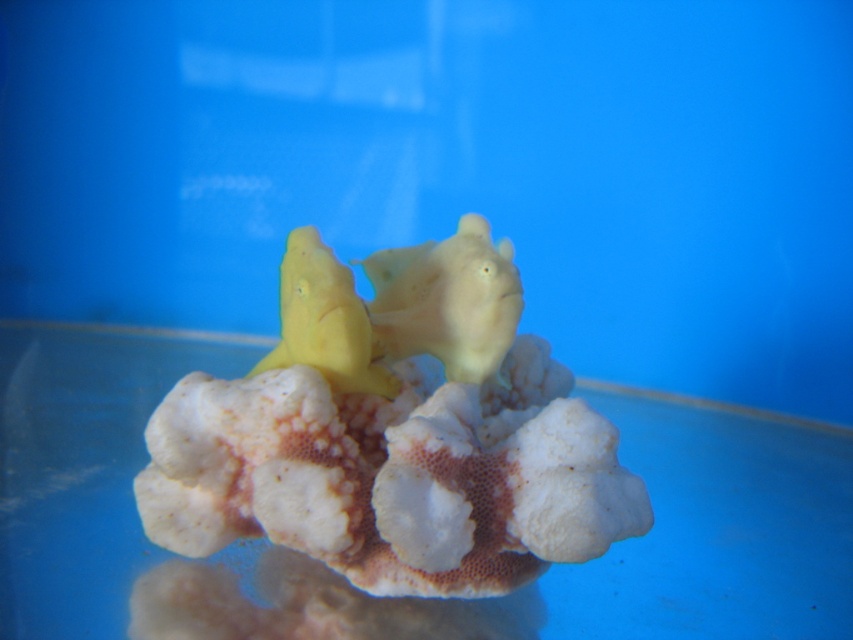
Which is more to the left, matte yellow fish at center or yellow matte fish at center?

From the viewer's perspective, yellow matte fish at center appears more on the left side.

Does matte yellow fish at center appear under yellow matte fish at center?

Actually, matte yellow fish at center is above yellow matte fish at center.

What are the coordinates of `matte yellow fish at center` in the screenshot? It's located at (445, 301).